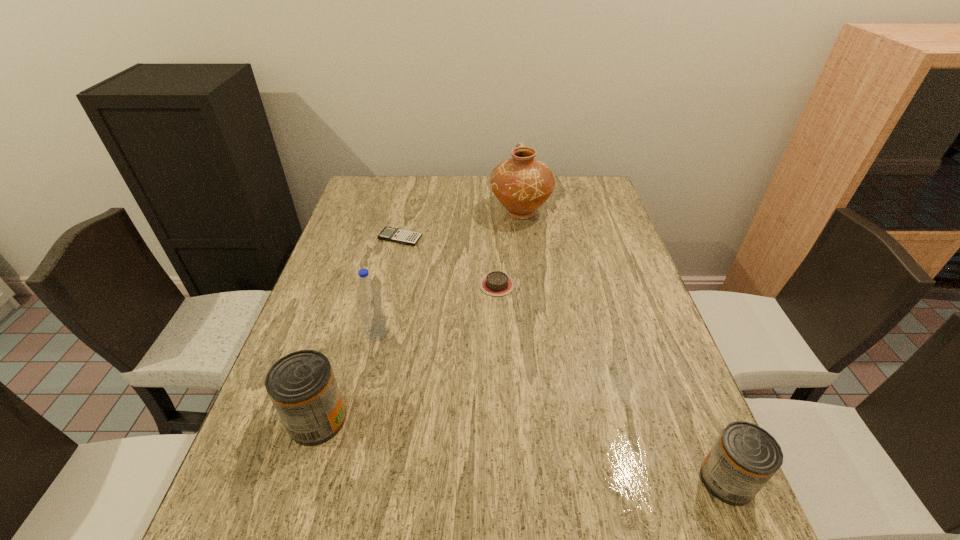
Image resolution: width=960 pixels, height=540 pixels. In order to click on empty space between the pottery and the fifth farthest object in this screenshot , I will do `click(419, 316)`.

In order to click on free area in between the nearer can and the shortest object in this screenshot , I will do `click(564, 359)`.

Where is `vacant space that is in between the nearer can and the pottery`? Image resolution: width=960 pixels, height=540 pixels. vacant space that is in between the nearer can and the pottery is located at coordinates (623, 346).

The image size is (960, 540). I want to click on blank region between the nearest object and the shortest object, so click(x=564, y=359).

Locate an element on the screen. This screenshot has height=540, width=960. vacant point located between the water bottle and the shortest object is located at coordinates (388, 285).

Locate an element on the screen. This screenshot has height=540, width=960. unoccupied position between the chocolate cake and the water bottle is located at coordinates pyautogui.click(x=437, y=308).

This screenshot has height=540, width=960. Find the location of `unoccupied area between the right can and the third farthest object`. unoccupied area between the right can and the third farthest object is located at coordinates coord(612,382).

You are a GUI agent. You are given a task and a screenshot of the screen. Output one action in this format:
    pyautogui.click(x=<x>, y=<y>)
    Task: Click on the vacant area that lies between the fifth farthest object and the pottery
    
    Given the screenshot: What is the action you would take?
    pyautogui.click(x=419, y=316)

Find the location of a particular element. The height and width of the screenshot is (540, 960). vacant space that is in between the calculator and the nearer can is located at coordinates (564, 359).

What are the coordinates of `blank region between the third farthest object and the shortest object` in the screenshot? It's located at (448, 261).